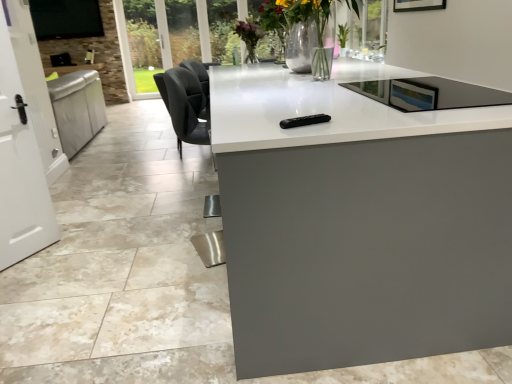
Question: From the image's perspective, relative to white glossy countertop at center, is translucent glass vase at center above or below?

Choices:
 (A) above
 (B) below

Answer: (A)

Question: Relative to white glossy countertop at center, is translucent glass vase at center in front or behind?

Choices:
 (A) front
 (B) behind

Answer: (B)

Question: Considering the real-world distances, which object is closest to the translucent glass vase at center?

Choices:
 (A) black leather swivel chair at center
 (B) black glass tv at upper left
 (C) white glossy countertop at center
 (D) white glossy door at left

Answer: (A)

Question: Which object is the farthest from the white glossy countertop at center?

Choices:
 (A) white glossy door at left
 (B) translucent glass vase at center
 (C) black leather swivel chair at center
 (D) black glass tv at upper left

Answer: (D)